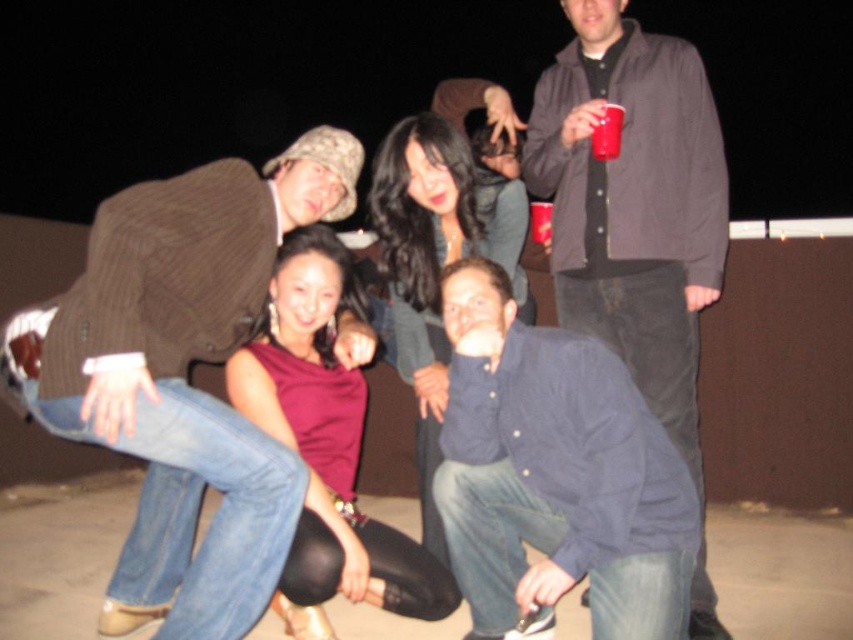
Between dark gray jacket at upper right and red plastic cup at upper center, which one appears on the right side from the viewer's perspective?

From the viewer's perspective, dark gray jacket at upper right appears more on the right side.

Is point (601, 336) closer to camera compared to point (618, 154)?

No, (601, 336) is further to viewer.

The image size is (853, 640). What do you see at coordinates (633, 202) in the screenshot? I see `dark gray jacket at upper right` at bounding box center [633, 202].

Identify the location of dark gray jacket at upper right. This screenshot has width=853, height=640. (633, 202).

Is shiny black hair at center above matte plastic cup at upper center?

Incorrect, shiny black hair at center is not positioned above matte plastic cup at upper center.

Is shiny black hair at center to the right of matte plastic cup at upper center from the viewer's perspective?

No, shiny black hair at center is not to the right of matte plastic cup at upper center.

Who is more forward, [415,145] or [548,204]?

Point [415,145] is more forward.

Find the location of a particular element. shiny black hair at center is located at coordinates (437, 260).

Can you confirm if shiny magenta dress at center is wider than red plastic cup at upper center?

Correct, the width of shiny magenta dress at center exceeds that of red plastic cup at upper center.

Is shiny magenta dress at center taller than red plastic cup at upper center?

Indeed, shiny magenta dress at center has a greater height compared to red plastic cup at upper center.

Between point (310, 582) and point (601, 122), which one is positioned behind?

The point (601, 122) is more distant.

Locate an element on the screen. shiny magenta dress at center is located at coordinates (326, 445).